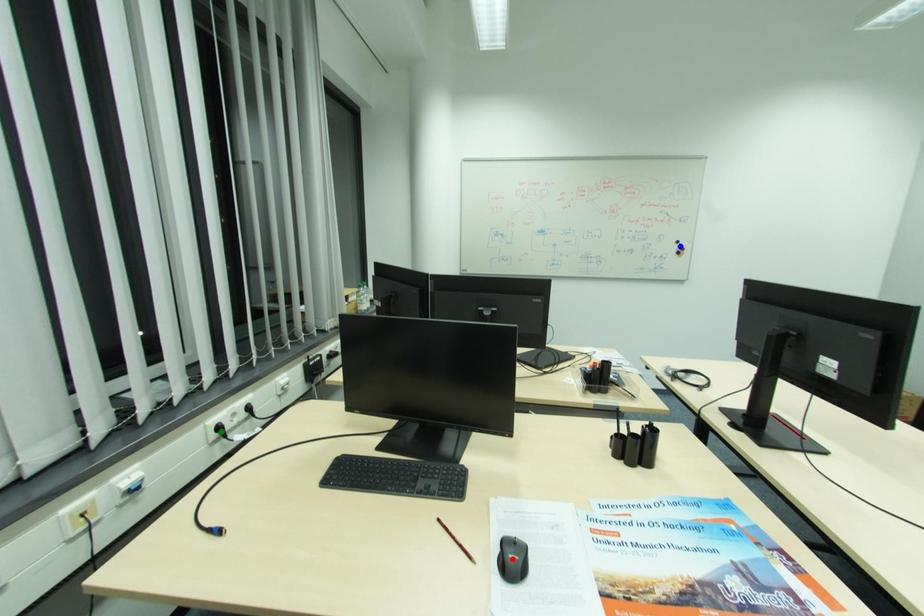
Order these from farthest to nearest:
red point | green point | blue point

1. blue point
2. green point
3. red point